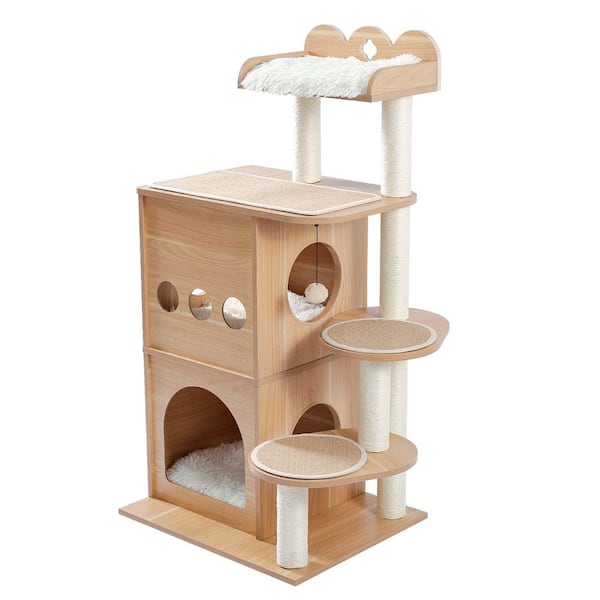
Where is `circular entry`? The height and width of the screenshot is (600, 600). circular entry is located at coordinates (320, 241).